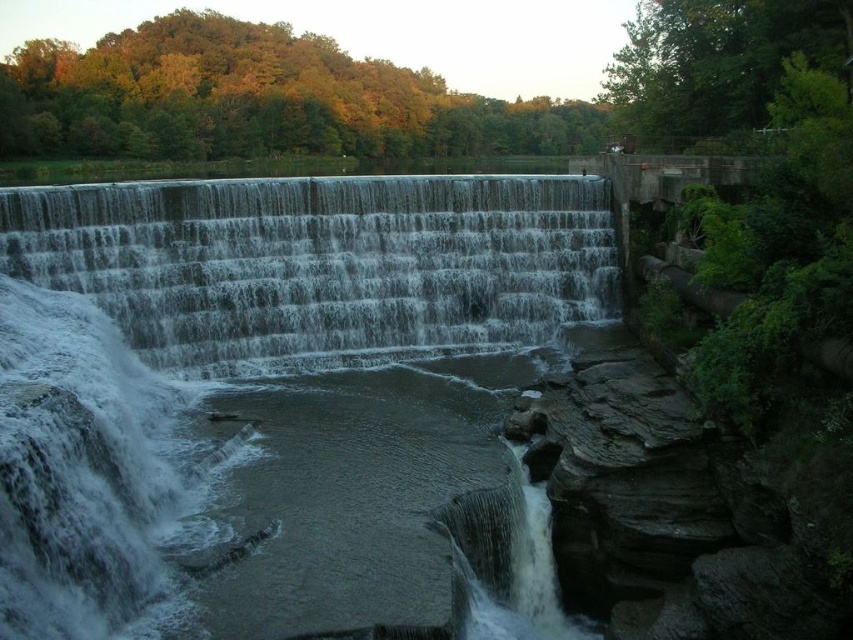
You are standing in front of the waterfall scene. You want to take a photo of the clear water at center and the gray concrete waterfall at center. Which object should you focus on first to ensure both are in sharp focus?

You should focus on the gray concrete waterfall at center first because it is farther away than the clear water at center, so focusing on the farther object ensures both will be in focus.

You are standing in front of the waterfall and want to place a small decorative rock on the left side of the gray concrete waterfall at center. Where should you place it relative to the clear water at center?

The clear water at center is positioned on the right side of the gray concrete waterfall at center, so to place the decorative rock on the left side of the gray concrete waterfall at center, you should place it to the left of the clear water at center.